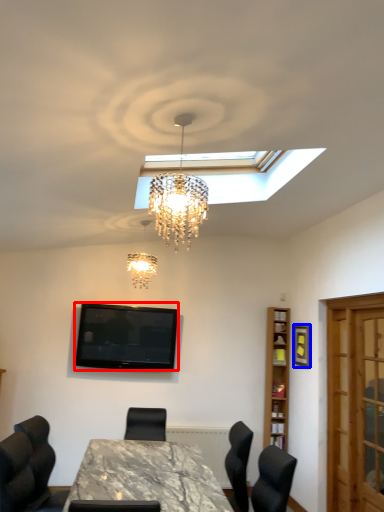
Question: Which of the following is the farthest to the observer, television (highlighted by a red box) or picture frame (highlighted by a blue box)?

Choices:
 (A) television
 (B) picture frame

Answer: (A)